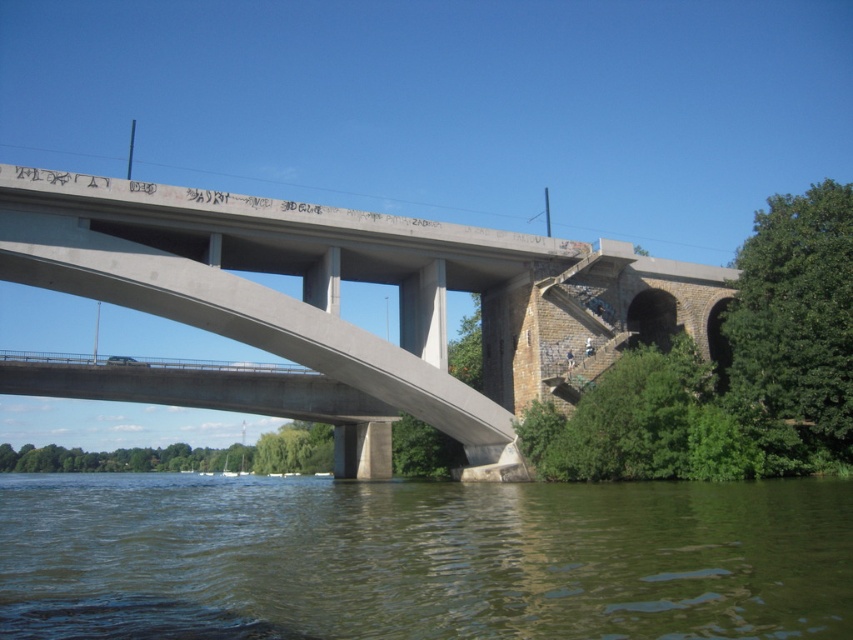
Question: Can you confirm if greenish water at lower center is positioned to the left of concrete bridge at center?

Choices:
 (A) yes
 (B) no

Answer: (B)

Question: Which of the following is the closest to the observer?

Choices:
 (A) (280, 348)
 (B) (782, 534)

Answer: (B)

Question: Is greenish water at lower center below concrete bridge at center?

Choices:
 (A) yes
 (B) no

Answer: (A)

Question: Among these points, which one is farthest from the camera?

Choices:
 (A) (810, 618)
 (B) (422, 248)

Answer: (B)

Question: Is greenish water at lower center positioned behind concrete bridge at center?

Choices:
 (A) yes
 (B) no

Answer: (B)